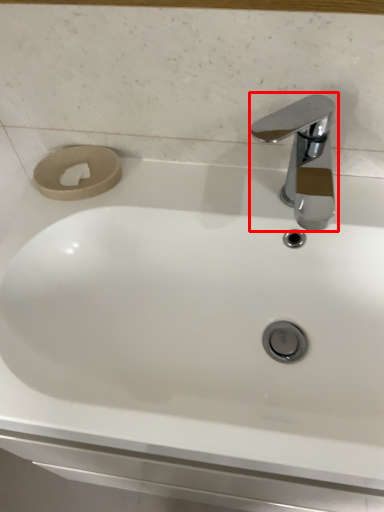
Question: In this image, where is tap (annotated by the red box) located relative to toilet paper?

Choices:
 (A) right
 (B) left

Answer: (A)